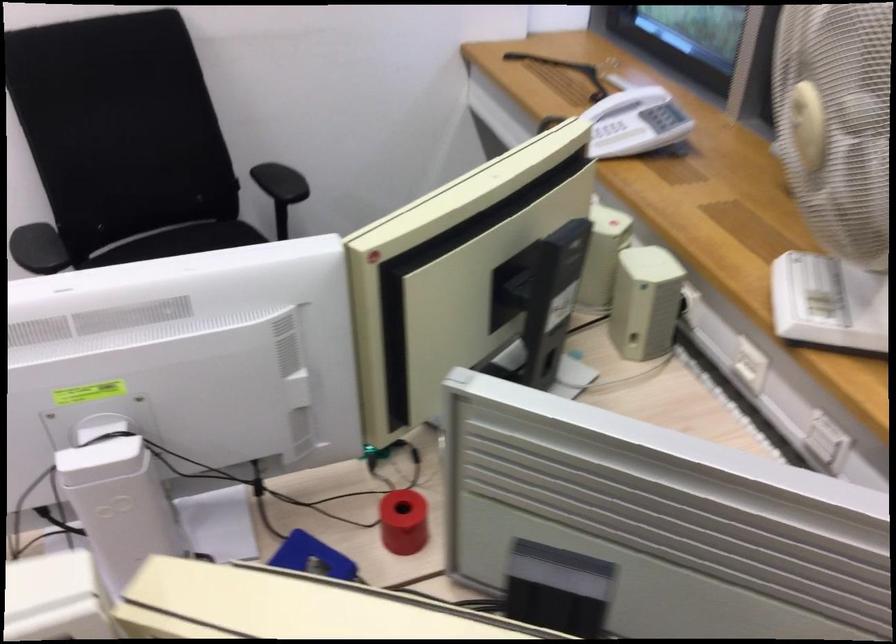
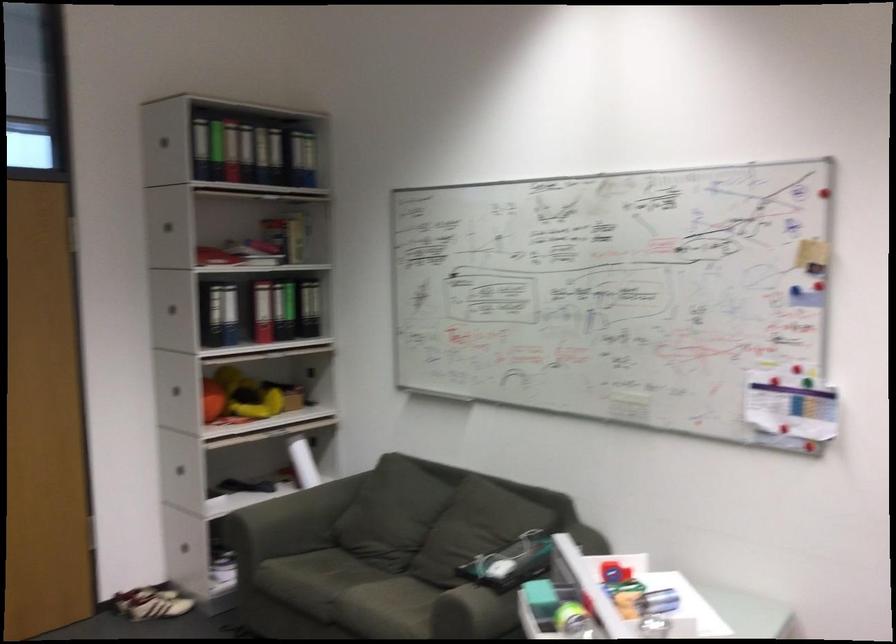
Question: The first image is from the beginning of the video and the second image is from the end. How did the camera likely rotate when shooting the video?

Choices:
 (A) Left
 (B) Right
 (C) Up
 (D) Down

Answer: (A)